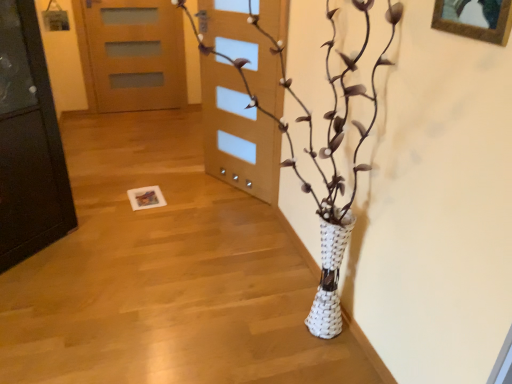
This screenshot has height=384, width=512. What do you see at coordinates (475, 19) in the screenshot?
I see `wooden picture frame at upper right` at bounding box center [475, 19].

Identify the location of wooden door at upper center. (135, 54).

Considering the sizes of objects wooden picture frame at upper right and wooden door at upper center in the image provided, who is taller, wooden picture frame at upper right or wooden door at upper center?

With more height is wooden door at upper center.

You are a GUI agent. You are given a task and a screenshot of the screen. Output one action in this format:
    pyautogui.click(x=<x>, y=<y>)
    Task: Click on the picture frame below the wooden door at upper center (from the image's perspective)
    The width and height of the screenshot is (512, 384).
    Given the screenshot: What is the action you would take?
    pyautogui.click(x=475, y=19)

Is wooden picture frame at upper right oriented away from wooden door at upper center?

wooden picture frame at upper right does not have its back to wooden door at upper center.

Is wooden door at upper center smaller than wooden picture frame at upper right?

Actually, wooden door at upper center might be larger than wooden picture frame at upper right.

Is wooden door at upper center outside of wooden picture frame at upper right?

Yes, wooden door at upper center is located beyond the bounds of wooden picture frame at upper right.

Between wooden door at upper center and wooden picture frame at upper right, which one has smaller width?

With smaller width is wooden picture frame at upper right.

Locate an element on the screen. This screenshot has width=512, height=384. door behind the wooden picture frame at upper right is located at coordinates (135, 54).

Measure the distance from white woven vase at center to wooden door at upper center.

white woven vase at center is 6.39 feet away from wooden door at upper center.

Is white woven vase at center touching wooden door at upper center?

They are not placed beside each other.

Between white woven vase at center and wooden door at upper center, which one has smaller width?

With smaller width is wooden door at upper center.

Which is behind, white woven vase at center or wooden door at upper center?

wooden door at upper center is behind.

Does wooden picture frame at upper right turn towards white woven vase at center?

Yes, wooden picture frame at upper right is oriented towards white woven vase at center.

From the picture: Between wooden picture frame at upper right and white woven vase at center, which one has larger width?

white woven vase at center is wider.

From the image's perspective, which is above, wooden picture frame at upper right or white woven vase at center?

wooden picture frame at upper right, from the image's perspective.

Based on their positions, is wooden picture frame at upper right located to the left or right of white woven vase at center?

wooden picture frame at upper right is to the right of white woven vase at center.

Is point (83, 2) positioned in front of point (348, 89)?

No, (83, 2) is further to viewer.

Which of these two, wooden door at upper center or white woven vase at center, is wider?

white woven vase at center is wider.

Is white woven vase at center at the back of wooden door at upper center?

wooden door at upper center does not have its back to white woven vase at center.

Is wooden door at upper center to the left or to the right of white woven vase at center in the image?

Clearly, wooden door at upper center is on the left of white woven vase at center in the image.

From a real-world perspective, between white woven vase at center and wooden picture frame at upper right, who is vertically lower?

From a 3D spatial view, white woven vase at center is below.

How many degrees apart are the facing directions of white woven vase at center and wooden picture frame at upper right?

There is a 0.542-degree angle between the facing directions of white woven vase at center and wooden picture frame at upper right.

The image size is (512, 384). What are the coordinates of `picture frame above the white woven vase at center (from a real-world perspective)` in the screenshot? It's located at (475, 19).

Does white woven vase at center touch wooden picture frame at upper right?

No, white woven vase at center is not making contact with wooden picture frame at upper right.

The image size is (512, 384). What are the coordinates of `door behind the wooden picture frame at upper right` in the screenshot? It's located at (135, 54).

The image size is (512, 384). Find the location of `door that is under the wooden picture frame at upper right (from a real-world perspective)`. door that is under the wooden picture frame at upper right (from a real-world perspective) is located at coordinates (135, 54).

When comparing their distances from wooden picture frame at upper right, does wooden door at upper center or white woven vase at center seem further?

The object further to wooden picture frame at upper right is wooden door at upper center.

Estimate the real-world distances between objects in this image. Which object is closer to wooden door at upper center, white woven vase at center or wooden picture frame at upper right?

The object closer to wooden door at upper center is white woven vase at center.

Based on their spatial positions, is wooden door at upper center or wooden picture frame at upper right further from white woven vase at center?

Based on the image, wooden door at upper center appears to be further to white woven vase at center.

Looking at this image, when comparing their distances from wooden picture frame at upper right, does white woven vase at center or wooden door at upper center seem further?

The object further to wooden picture frame at upper right is wooden door at upper center.

In the scene shown: When comparing their distances from white woven vase at center, does wooden picture frame at upper right or wooden door at upper center seem further?

wooden door at upper center is further to white woven vase at center.

From the image, which object appears to be farther from wooden door at upper center, wooden picture frame at upper right or white woven vase at center?

wooden picture frame at upper right is further to wooden door at upper center.

Find the location of a particular element. This screenshot has height=384, width=512. picture frame located between white woven vase at center and wooden door at upper center in the depth direction is located at coordinates pyautogui.click(x=475, y=19).